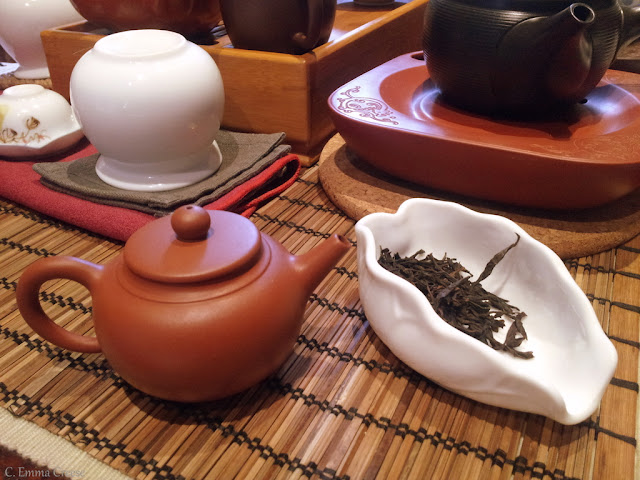
This screenshot has height=480, width=640. In order to click on round plate in this screenshot , I will do pyautogui.click(x=354, y=190).